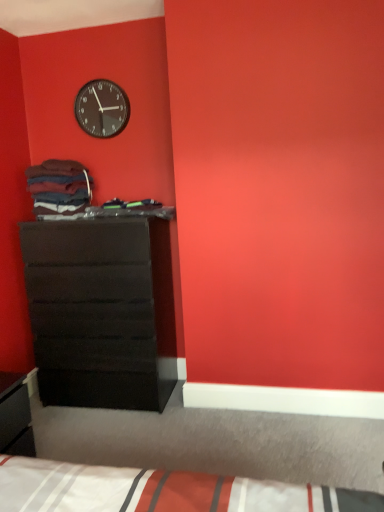
The height and width of the screenshot is (512, 384). Identify the location of vacant area in front of matte black chest of drawers at left. (100, 435).